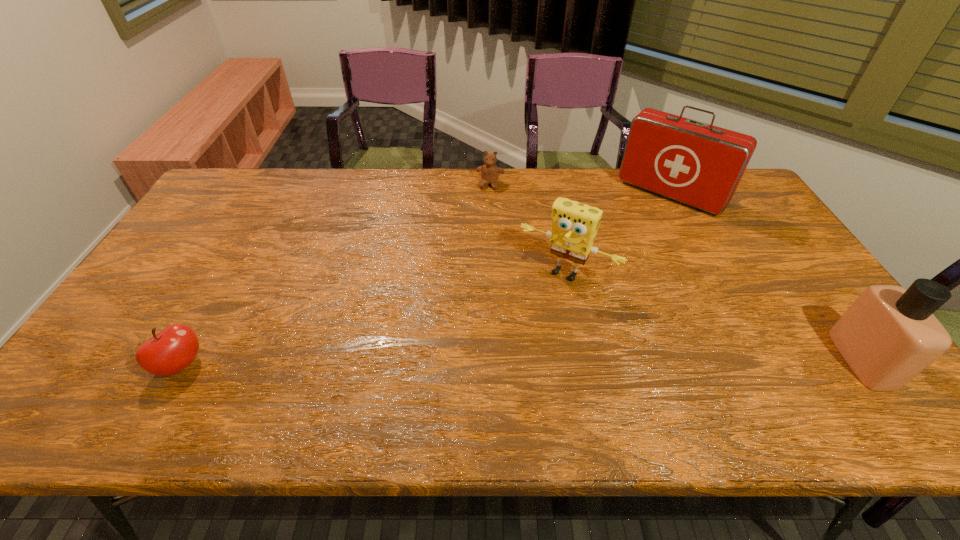
I want to click on free space on the desktop that is between the leftmost object and the perfume and is positioned on the face of the third object from left to right, so click(509, 362).

You are a GUI agent. You are given a task and a screenshot of the screen. Output one action in this format:
    pyautogui.click(x=<x>, y=<y>)
    Task: Click on the free space on the desktop that is between the apple and the perfume and is positioned on the side of the tallest object with the first aid cross symbol
    Image resolution: width=960 pixels, height=540 pixels.
    Given the screenshot: What is the action you would take?
    pyautogui.click(x=535, y=361)

You are a GUI agent. You are given a task and a screenshot of the screen. Output one action in this format:
    pyautogui.click(x=<x>, y=<y>)
    Task: Click on the free spot on the desktop that is between the leftmost object and the rightmost object and is positioned on the face of the second object from left to right
    The image size is (960, 540).
    Given the screenshot: What is the action you would take?
    pyautogui.click(x=449, y=362)